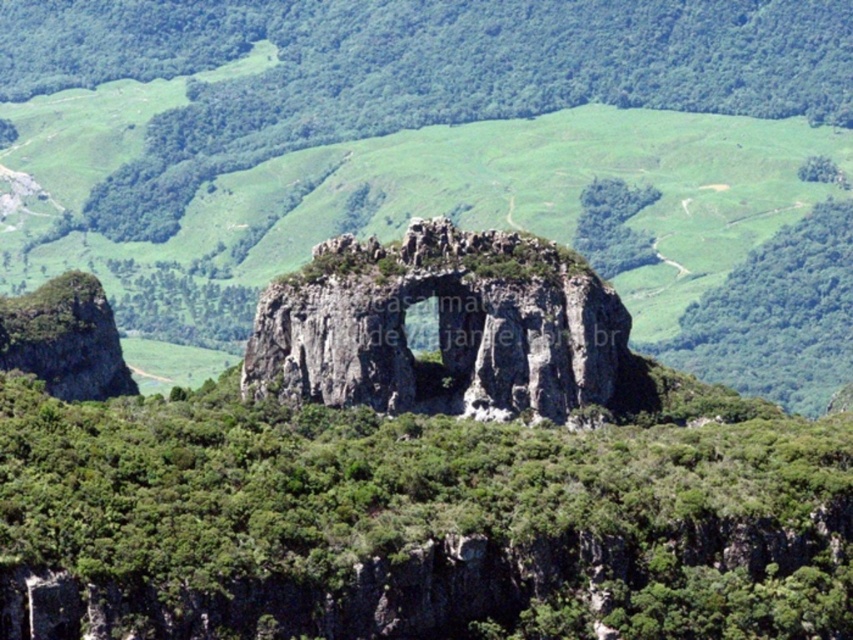
Is the position of green leafy vegetation at center more distant than that of gray rocky arch at center?

No, green leafy vegetation at center is closer to the viewer.

Does green leafy vegetation at center have a lesser height compared to gray rocky arch at center?

Yes, green leafy vegetation at center is shorter than gray rocky arch at center.

Does point (376, 605) come in front of point (297, 282)?

Yes.

Where is `green leafy vegetation at center`? This screenshot has height=640, width=853. green leafy vegetation at center is located at coordinates (416, 522).

Is point (526, 115) less distant than point (511, 285)?

No, (526, 115) is further to viewer.

You are a GUI agent. You are given a task and a screenshot of the screen. Output one action in this format:
    pyautogui.click(x=<x>, y=<y>)
    Task: Click on the rugged stone arch at center
    This screenshot has height=640, width=853.
    Given the screenshot: What is the action you would take?
    pyautogui.click(x=445, y=156)

At what (x,y) coordinates should I click in order to perform the action: click on rugged stone arch at center. Please return your answer as a coordinate pair (x, y). This screenshot has width=853, height=640. Looking at the image, I should click on (445, 156).

Can you confirm if rugged stone arch at center is shorter than green leafy vegetation at center?

No, rugged stone arch at center is not shorter than green leafy vegetation at center.

What do you see at coordinates (445, 156) in the screenshot?
I see `rugged stone arch at center` at bounding box center [445, 156].

Describe the element at coordinates (445, 156) in the screenshot. The height and width of the screenshot is (640, 853). I see `rugged stone arch at center` at that location.

You are a GUI agent. You are given a task and a screenshot of the screen. Output one action in this format:
    pyautogui.click(x=<x>, y=<y>)
    Task: Click on the rugged stone arch at center
    
    Given the screenshot: What is the action you would take?
    pyautogui.click(x=445, y=156)